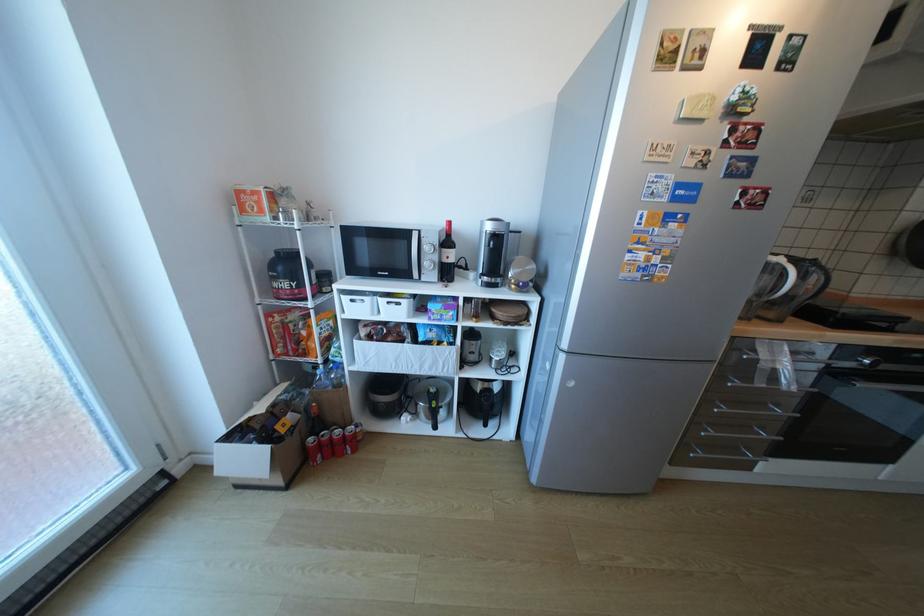
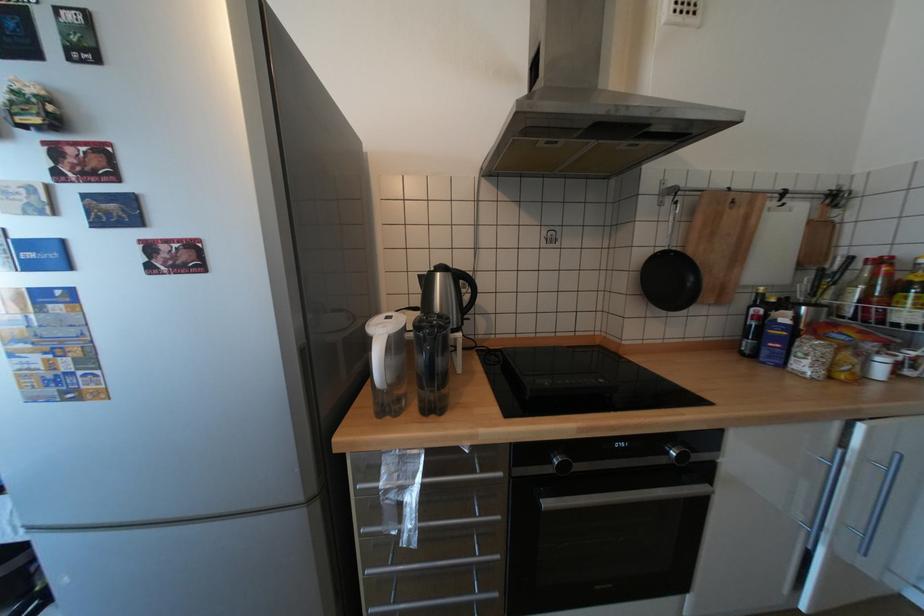
Question: In a continuous first-person perspective shot, in which direction is the camera moving?

Choices:
 (A) Left
 (B) Right
 (C) Forward
 (D) Backward

Answer: (B)